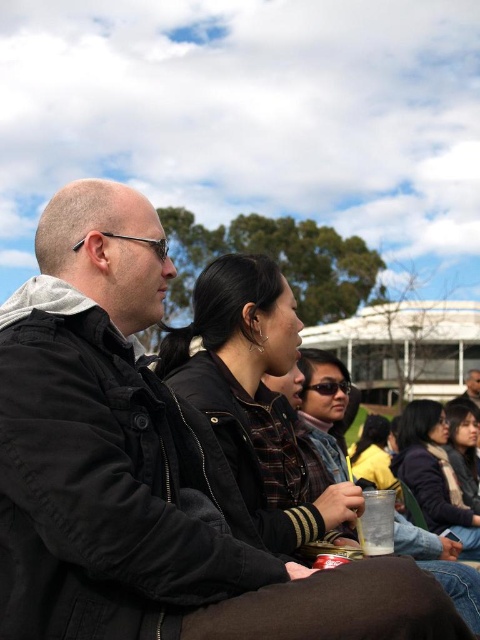
Does matte black jacket at center appear on the left side of dark brown hair at lower right?

Indeed, matte black jacket at center is positioned on the left side of dark brown hair at lower right.

Who is taller, matte black jacket at center or dark brown hair at lower right?

matte black jacket at center

Measure the distance between matte black jacket at center and camera.

A distance of 35.13 meters exists between matte black jacket at center and camera.

Identify the location of matte black jacket at center. (324, 404).

Is point (286, 499) behind point (335, 372)?

No, it is in front of (335, 372).

Is point (251, 336) closer to viewer compared to point (340, 394)?

That is True.

Locate an element on the screen. The height and width of the screenshot is (640, 480). black leather jacket at center is located at coordinates (254, 397).

This screenshot has height=640, width=480. I want to click on black leather jacket at center, so click(254, 397).

Can you confirm if black matte jacket at left is thinner than dark brown hair at lower right?

In fact, black matte jacket at left might be wider than dark brown hair at lower right.

In the scene shown: Measure the distance between point (115, 364) and camera.

A distance of 33.41 meters exists between point (115, 364) and camera.

In order to click on black matte jacket at left in this screenshot , I will do `click(144, 470)`.